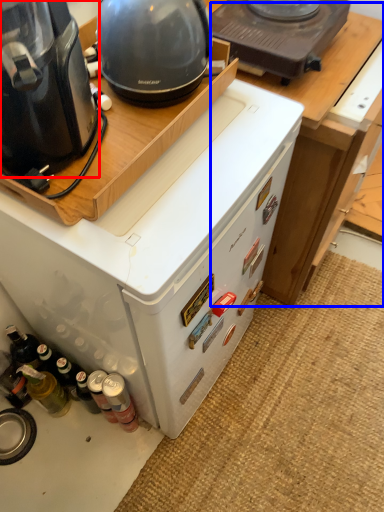
Question: Among these objects, which one is nearest to the camera, home appliance (highlighted by a red box) or table (highlighted by a blue box)?

Choices:
 (A) home appliance
 (B) table

Answer: (A)